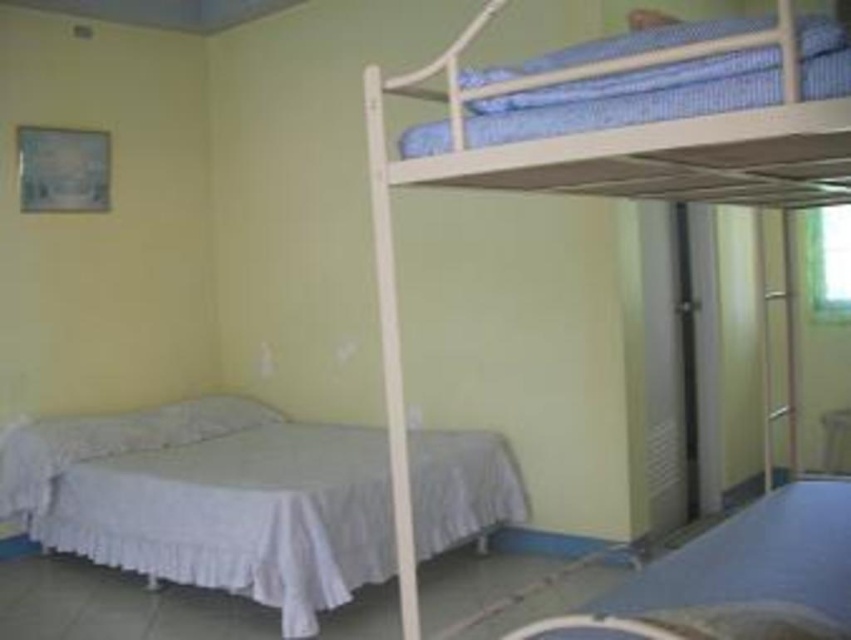
Question: Which of the following is the farthest from the observer?

Choices:
 (A) white fabric bed at lower left
 (B) blue striped pillow at upper right
 (C) white wooden bunk bed at upper right
 (D) white matte bedcover at lower right

Answer: (A)

Question: Is white fabric bed at lower left to the right of white wooden bunk bed at upper right from the viewer's perspective?

Choices:
 (A) no
 (B) yes

Answer: (A)

Question: Is white matte bedcover at lower right below blue striped pillow at upper right?

Choices:
 (A) no
 (B) yes

Answer: (B)

Question: Among these objects, which one is nearest to the camera?

Choices:
 (A) white matte bedcover at lower right
 (B) white wooden bunk bed at upper right
 (C) white fabric bed at lower left

Answer: (B)

Question: Which of the following is the closest to the observer?

Choices:
 (A) (461, 154)
 (B) (830, 602)
 (C) (367, 545)

Answer: (A)

Question: Is white matte bedcover at lower right below blue striped pillow at upper right?

Choices:
 (A) no
 (B) yes

Answer: (B)